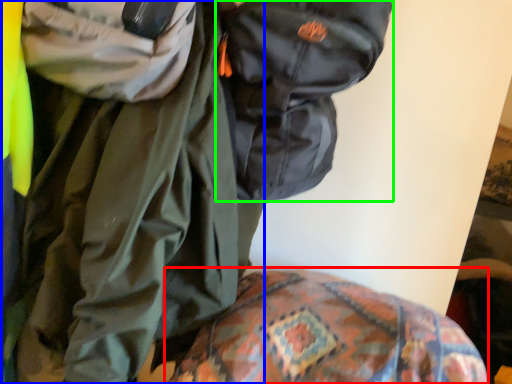
Question: Estimate the real-world distances between objects in this image. Which object is closer to bedding (highlighted by a red box), jacket (highlighted by a blue box) or backpack (highlighted by a green box)?

Choices:
 (A) jacket
 (B) backpack

Answer: (A)